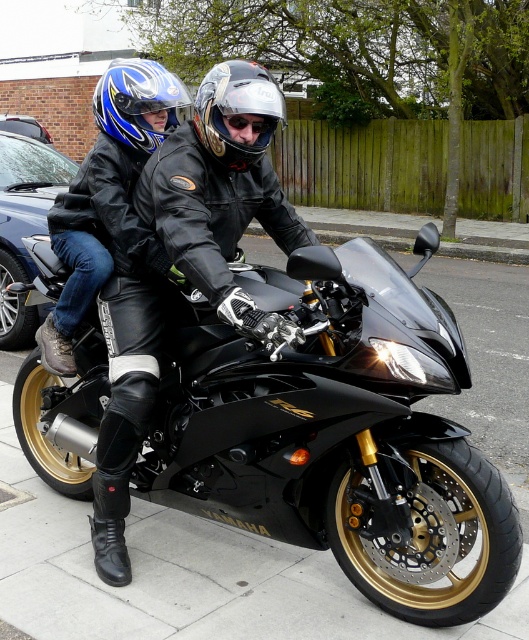
Who is more distant from viewer, [66,172] or [235,125]?

Positioned behind is point [66,172].

Between black glossy car at left and glossy plastic goggles at center, which one is positioned lower?

glossy plastic goggles at center is below.

Which is behind, point (32, 314) or point (276, 122)?

The point (32, 314) is more distant.

Locate an element on the screen. black glossy car at left is located at coordinates (24, 225).

Does black glossy car at left have a greater height compared to glossy metallic helmet at center?

Yes, black glossy car at left is taller than glossy metallic helmet at center.

Can you confirm if black glossy car at left is positioned to the right of glossy metallic helmet at center?

No, black glossy car at left is not to the right of glossy metallic helmet at center.

Which is behind, point (7, 170) or point (234, 134)?

Positioned behind is point (7, 170).

At what (x,y) coordinates should I click in order to perform the action: click on black glossy car at left. Please return your answer as a coordinate pair (x, y). The width and height of the screenshot is (529, 640). Looking at the image, I should click on (24, 225).

Between black leather jacket at center and matte black jacket at center, which one has more height?

black leather jacket at center

Does black leather jacket at center have a lesser width compared to matte black jacket at center?

No.

Between point (275, 196) and point (159, 125), which one is positioned in front?

Positioned in front is point (275, 196).

In order to click on black leather jacket at center in this screenshot , I will do `click(222, 195)`.